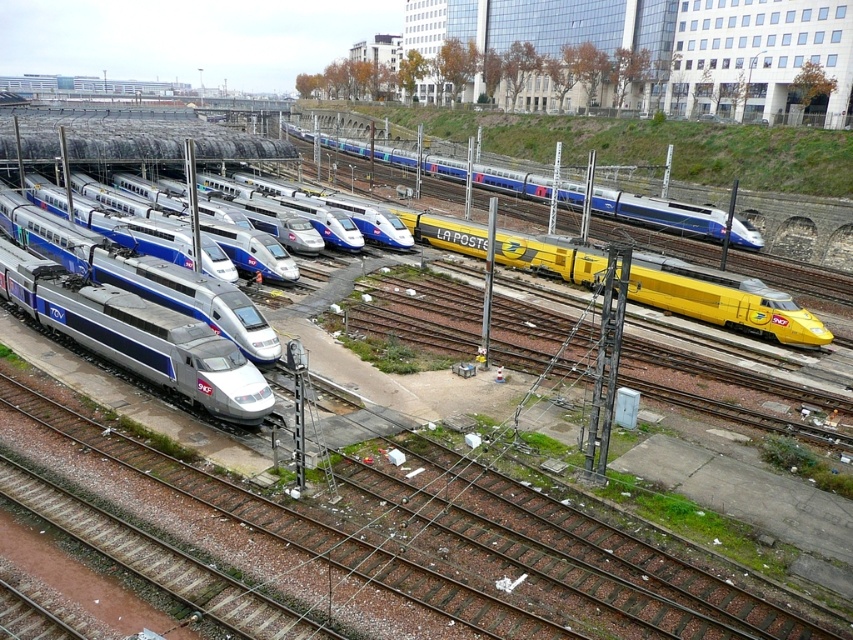
Question: Can you confirm if silver metallic train at left is positioned below yellow metallic train at center?

Choices:
 (A) no
 (B) yes

Answer: (B)

Question: Which of the following is the closest to the observer?

Choices:
 (A) yellow metallic train at center
 (B) silver metallic train at left

Answer: (B)

Question: Which point appears closest to the camera in this image?

Choices:
 (A) (463, 164)
 (B) (94, 301)

Answer: (B)

Question: Is silver metallic train at left further to camera compared to yellow metallic train at center?

Choices:
 (A) no
 (B) yes

Answer: (A)

Question: Can you confirm if silver metallic train at left is positioned to the right of yellow metallic train at center?

Choices:
 (A) yes
 (B) no

Answer: (B)